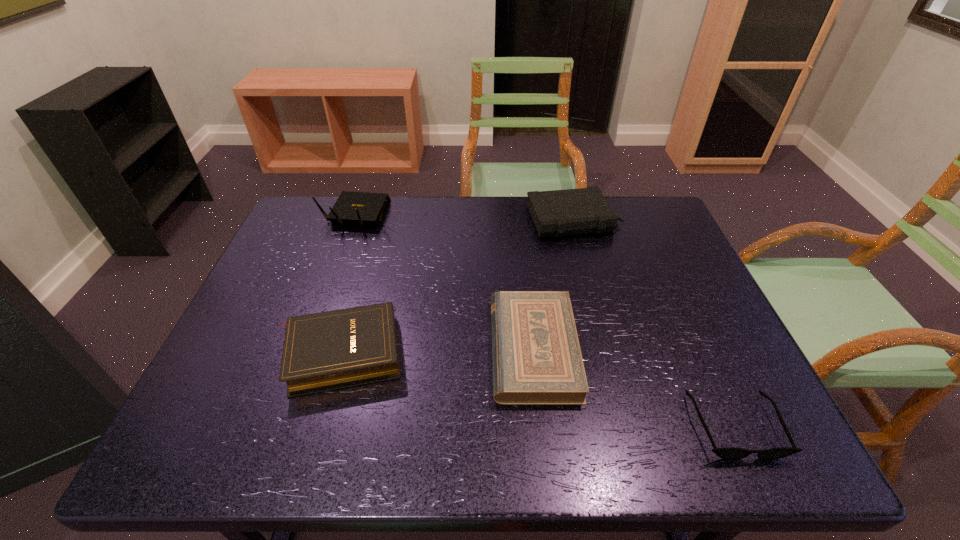
Locate an element on the screen. router is located at coordinates (358, 208).

Locate an element on the screen. the farthest Bible is located at coordinates (556, 213).

Find the location of a particular element. the leftmost Bible is located at coordinates (329, 350).

Locate an element on the screen. The image size is (960, 540). the shortest Bible is located at coordinates (536, 355).

Where is `sunglasses`? This screenshot has width=960, height=540. sunglasses is located at coordinates (729, 453).

Identify the location of vacant space located on the front of the router. (342, 259).

You are a GUI agent. You are given a task and a screenshot of the screen. Output one action in this format:
    pyautogui.click(x=<x>, y=<y>)
    Task: Click on the free space located 0.270m on the front of the farthest Bible
    
    Given the screenshot: What is the action you would take?
    pyautogui.click(x=598, y=308)

Image resolution: width=960 pixels, height=540 pixels. I want to click on vacant space located 0.110m on the right of the leftmost Bible, so click(x=452, y=353).

I want to click on free space located on the spine side of the shortest Bible, so click(470, 349).

Find the location of a particular element. free space located on the spine side of the shortest Bible is located at coordinates (457, 349).